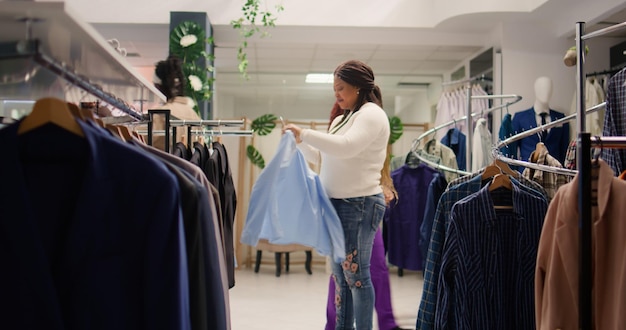
Identify the location of mannequin head. The height and width of the screenshot is (330, 626). (544, 87).